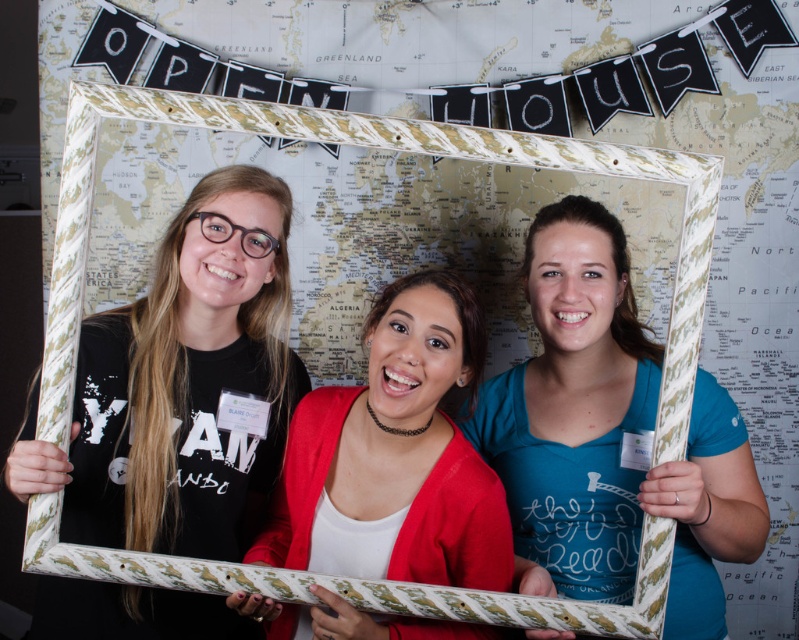
Describe the element at coordinates (609, 436) in the screenshot. I see `matte gold frame at center` at that location.

Does matte gold frame at center appear on the right side of matte red cardigan at center?

Indeed, matte gold frame at center is positioned on the right side of matte red cardigan at center.

Find the location of a particular element. The image size is (799, 640). matte gold frame at center is located at coordinates (609, 436).

Which is in front, point (217, 465) or point (694, 628)?

Point (217, 465) is more forward.

Which is behind, point (74, 449) or point (613, 566)?

Positioned behind is point (613, 566).

Is point (117, 522) positioned in front of point (591, 428)?

Yes, it is.

The image size is (799, 640). Find the location of `matte black frame at center`. matte black frame at center is located at coordinates [x=181, y=385].

Can you confirm if matte gold frame at center is positioned to the right of wooden frame at center?

Correct, you'll find matte gold frame at center to the right of wooden frame at center.

Locate an element on the screen. The image size is (799, 640). matte gold frame at center is located at coordinates pyautogui.click(x=609, y=436).

Where is `matte gold frame at center`? matte gold frame at center is located at coordinates (609, 436).